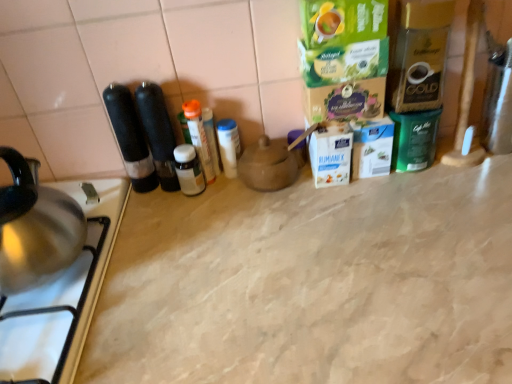
Question: From their relative heights in the image, would you say matte brown teapot at center is taller or shorter than white plastic container at center, the first bottle positioned from the right?

Choices:
 (A) short
 (B) tall

Answer: (A)

Question: Is matte brown teapot at center in front of or behind white plastic container at center, the first bottle positioned from the right, in the image?

Choices:
 (A) front
 (B) behind

Answer: (A)

Question: Which object is positioned farthest from the white plastic container at center, the 3th bottle in the left-to-right sequence?

Choices:
 (A) beige marble counter top at center
 (B) stainless steel gas stove at lower left
 (C) white glossy bottle at center, which is the third bottle from right to left
 (D) matte brown teapot at center
 (E) translucent plastic bottle at center, placed as the second bottle when sorted from left to right

Answer: (B)

Question: Which object is positioned closest to the white glossy bottle at center, positioned as the 1th bottle in left-to-right order?

Choices:
 (A) stainless steel gas stove at lower left
 (B) translucent plastic bottle at center, the 2th bottle from the right
 (C) matte brown teapot at center
 (D) beige marble counter top at center
 (E) white plastic container at center, the 3th bottle in the left-to-right sequence

Answer: (B)